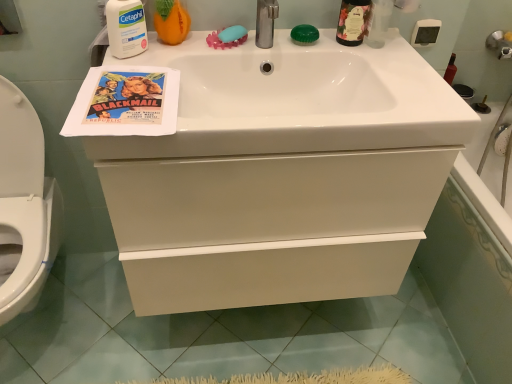
Locate an element on the screen. vacant area that lies between white matte cetaphil at upper left, which appears as the second cleaning product when viewed from the right, and blue rubber soap at upper center, which is the 2th soap from right to left is located at coordinates (174, 49).